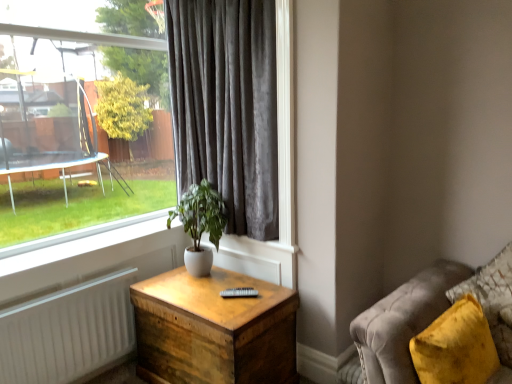
What do you see at coordinates (493, 299) in the screenshot? The height and width of the screenshot is (384, 512). I see `velvet yellow pillow at lower right` at bounding box center [493, 299].

What is the approximate width of velvet yellow pillow at lower right?

velvet yellow pillow at lower right is 18.87 inches wide.

What is the approximate width of velvet gray curtain at center?

velvet gray curtain at center is 8.49 inches wide.

The width and height of the screenshot is (512, 384). Describe the element at coordinates (227, 106) in the screenshot. I see `velvet gray curtain at center` at that location.

This screenshot has height=384, width=512. What do you see at coordinates (68, 331) in the screenshot?
I see `white matte radiator at lower left` at bounding box center [68, 331].

At what (x,y) coordinates should I click in order to perform the action: click on velvet yellow pillow at lower right. Please return your answer as a coordinate pair (x, y). Image resolution: width=512 pixels, height=384 pixels. Looking at the image, I should click on (433, 317).

Does velvet gray curtain at center come in front of clear glass window at upper left?

No, it is not.

Between velvet gray curtain at center and clear glass window at upper left, which one has more height?

Standing taller between the two is clear glass window at upper left.

Is velvet gray curtain at center to the left of clear glass window at upper left from the viewer's perspective?

Incorrect, velvet gray curtain at center is not on the left side of clear glass window at upper left.

Can you tell me how much velvet gray curtain at center and clear glass window at upper left differ in facing direction?

90 degrees.

Considering the sizes of objects velvet yellow pillow at lower right and white ceramic plant at center in the image provided, who is bigger, velvet yellow pillow at lower right or white ceramic plant at center?

velvet yellow pillow at lower right.

From a real-world perspective, is velvet yellow pillow at lower right over white ceramic plant at center?

No, from a real-world perspective, velvet yellow pillow at lower right is not above white ceramic plant at center.

What's the angular difference between velvet yellow pillow at lower right and white ceramic plant at center's facing directions?

They differ by 32.8 degrees in their facing directions.

Is velvet yellow pillow at lower right positioned beyond the bounds of white ceramic plant at center?

velvet yellow pillow at lower right lies outside white ceramic plant at center's area.

From a real-world perspective, is velvet yellow pillow at lower right positioned above or below velvet yellow pillow at lower right?

Clearly, from a real-world perspective, velvet yellow pillow at lower right is above velvet yellow pillow at lower right.

Between velvet yellow pillow at lower right and velvet yellow pillow at lower right, which one is positioned behind?

velvet yellow pillow at lower right is more distant.

Is the surface of velvet yellow pillow at lower right in direct contact with velvet yellow pillow at lower right?

They are not placed beside each other.

Based on the photo, is wooden nightstand at center to the right of white matte radiator at lower left from the viewer's perspective?

Yes, wooden nightstand at center is to the right of white matte radiator at lower left.

Considering the points (202, 334) and (21, 358), which point is in front, point (202, 334) or point (21, 358)?

The point (202, 334) is closer to the camera.

Consider the image. From the image's perspective, is wooden nightstand at center above or below white matte radiator at lower left?

Based on their image positions, wooden nightstand at center is located beneath white matte radiator at lower left.

Can you tell me how much wooden nightstand at center and white matte radiator at lower left differ in facing direction?

The angle between the facing direction of wooden nightstand at center and the facing direction of white matte radiator at lower left is 89.9 degrees.

Which of these two, white ceramic plant at center or velvet gray curtain at center, stands shorter?

Answer: white ceramic plant at center.

Is white ceramic plant at center smaller than velvet gray curtain at center?

Yes.

Is white ceramic plant at center looking in the opposite direction of velvet gray curtain at center?

That's right, white ceramic plant at center is facing away from velvet gray curtain at center.

Does point (286, 340) come behind point (483, 287)?

That is True.

The height and width of the screenshot is (384, 512). I want to click on nightstand that appears behind the velvet yellow pillow at lower right, so click(x=214, y=330).

Does wooden nightstand at center appear on the right side of velvet yellow pillow at lower right?

No, wooden nightstand at center is not to the right of velvet yellow pillow at lower right.

Looking at this image, choose the correct answer: Is wooden nightstand at center inside velvet yellow pillow at lower right or outside it?

wooden nightstand at center lies outside velvet yellow pillow at lower right.

Between velvet gray curtain at center and white ceramic plant at center, which one is positioned behind?

white ceramic plant at center is more distant.

Can you confirm if velvet gray curtain at center is positioned to the left of white ceramic plant at center?

In fact, velvet gray curtain at center is to the right of white ceramic plant at center.

Is velvet gray curtain at center touching white ceramic plant at center?

velvet gray curtain at center and white ceramic plant at center are clearly separated.

From a real-world perspective, who is located lower, velvet gray curtain at center or white ceramic plant at center?

white ceramic plant at center, from a real-world perspective.

The width and height of the screenshot is (512, 384). What are the coordinates of `curtain that is under the clear glass window at upper left (from a real-world perspective)` in the screenshot? It's located at (227, 106).

The width and height of the screenshot is (512, 384). I want to click on pillow that appears below the white ceramic plant at center (from the image's perspective), so click(x=493, y=299).

Based on their spatial positions, is velvet yellow pillow at lower right or velvet gray curtain at center further from clear glass window at upper left?

Based on the image, velvet yellow pillow at lower right appears to be further to clear glass window at upper left.

Which object lies further to the anchor point velvet yellow pillow at lower right, velvet gray curtain at center or wooden nightstand at center?

velvet gray curtain at center is further to velvet yellow pillow at lower right.

Which object lies nearer to the anchor point white matte radiator at lower left, clear glass window at upper left or velvet gray curtain at center?

clear glass window at upper left.

From the image, which object appears to be farther from velvet gray curtain at center, velvet yellow pillow at lower right or clear glass window at upper left?

The object further to velvet gray curtain at center is velvet yellow pillow at lower right.

Based on their spatial positions, is velvet yellow pillow at lower right or velvet gray curtain at center closer to white matte radiator at lower left?

The object closer to white matte radiator at lower left is velvet gray curtain at center.

Based on the photo, estimate the real-world distances between objects in this image. Which object is closer to wooden nightstand at center, white ceramic plant at center or velvet yellow pillow at lower right?

white ceramic plant at center lies closer to wooden nightstand at center than the other object.

When comparing their distances from white matte radiator at lower left, does velvet gray curtain at center or velvet yellow pillow at lower right seem further?

Among the two, velvet yellow pillow at lower right is located further to white matte radiator at lower left.

Based on their spatial positions, is clear glass window at upper left or wooden nightstand at center further from velvet gray curtain at center?

The object further to velvet gray curtain at center is clear glass window at upper left.

Image resolution: width=512 pixels, height=384 pixels. What are the coordinates of `curtain situated between white matte radiator at lower left and velvet yellow pillow at lower right from left to right` in the screenshot? It's located at (227, 106).

Where is `studio couch located between white ceramic plant at center and velvet yellow pillow at lower right in the left-right direction`? studio couch located between white ceramic plant at center and velvet yellow pillow at lower right in the left-right direction is located at coordinates (433, 317).

Find the location of a particular element. The width and height of the screenshot is (512, 384). houseplant between clear glass window at upper left and velvet yellow pillow at lower right from left to right is located at coordinates (200, 224).

The image size is (512, 384). I want to click on radiator between velvet gray curtain at center and wooden nightstand at center in the up-down direction, so click(x=68, y=331).